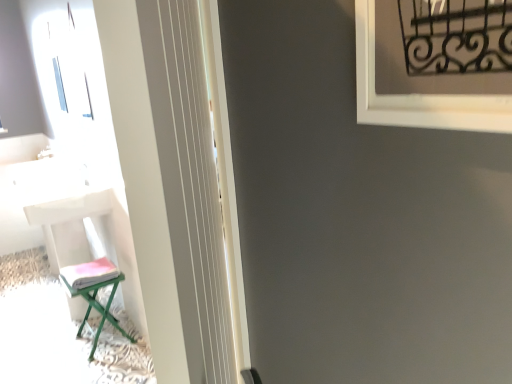
Describe the element at coordinates (87, 262) in the screenshot. I see `white plastic chair at left, the 1th furniture in the left-to-right sequence` at that location.

Identify the location of green metallic stool at lower left, the second furniture positioned from the left. (99, 308).

The image size is (512, 384). What do you see at coordinates (419, 95) in the screenshot?
I see `black wrought iron at upper right` at bounding box center [419, 95].

What do you see at coordinates (73, 221) in the screenshot? Image resolution: width=512 pixels, height=384 pixels. I see `white glossy table at left` at bounding box center [73, 221].

The height and width of the screenshot is (384, 512). I want to click on white plastic chair at left, marked as the second furniture in a right-to-left arrangement, so click(87, 262).

Based on the photo, would you say white glossy screen door at left is a long distance from black wrought iron at upper right?

No, white glossy screen door at left is not far from black wrought iron at upper right.

Find the location of a particular element. window frame above the white glossy screen door at left (from the image's perspective) is located at coordinates (419, 95).

Which object is further away from the camera taking this photo, white glossy screen door at left or black wrought iron at upper right?

Positioned behind is white glossy screen door at left.

Can you confirm if white glossy table at left is bigger than white glossy screen door at left?

Indeed, white glossy table at left has a larger size compared to white glossy screen door at left.

There is a white glossy table at left. Find the location of `screen door above it (from a real-world perspective)`. screen door above it (from a real-world perspective) is located at coordinates click(187, 206).

Does point (65, 213) lie behind point (205, 347)?

Yes.

From the image's perspective, between white glossy table at left and white glossy screen door at left, who is located below?

white glossy table at left is shown below in the image.

Would you say green metallic stool at lower left, the second furniture positioned from the left, is part of white glossy screen door at left's contents?

No.

From a real-world perspective, does white glossy screen door at left sit lower than green metallic stool at lower left, the 1th furniture positioned from the right?

No.

Locate an element on the screen. furniture that is the 2nd object directly below the white glossy screen door at left (from a real-world perspective) is located at coordinates (99, 308).

Choose the correct answer: Is white plastic chair at left, marked as the second furniture in a right-to-left arrangement, inside white glossy screen door at left or outside it?

white plastic chair at left, marked as the second furniture in a right-to-left arrangement, is outside white glossy screen door at left.

From the image's perspective, which one is positioned lower, white plastic chair at left, the 1th furniture in the left-to-right sequence, or white glossy screen door at left?

From the image's view, white plastic chair at left, the 1th furniture in the left-to-right sequence, is below.

Is white plastic chair at left, the 1th furniture in the left-to-right sequence, in contact with white glossy screen door at left?

white plastic chair at left, the 1th furniture in the left-to-right sequence, is not next to white glossy screen door at left, and they're not touching.

Is white plastic chair at left, the 1th furniture in the left-to-right sequence, looking in the opposite direction of white glossy screen door at left?

No, white plastic chair at left, the 1th furniture in the left-to-right sequence,'s orientation is not away from white glossy screen door at left.

Consider the image. From the image's perspective, between white plastic chair at left, the 1th furniture in the left-to-right sequence, and green metallic stool at lower left, the second furniture positioned from the left, which one is located above?

From the image's view, white plastic chair at left, the 1th furniture in the left-to-right sequence, is above.

Is white plastic chair at left, the 1th furniture in the left-to-right sequence, looking in the opposite direction of green metallic stool at lower left, the 1th furniture positioned from the right?

No, white plastic chair at left, the 1th furniture in the left-to-right sequence, is not facing the opposite direction of green metallic stool at lower left, the 1th furniture positioned from the right.

Does point (103, 275) come in front of point (100, 321)?

Yes.

Would you say white plastic chair at left, marked as the second furniture in a right-to-left arrangement, is a long distance from green metallic stool at lower left, the second furniture positioned from the left?

They are positioned close to each other.

Could you measure the distance between black wrought iron at upper right and green metallic stool at lower left, the 1th furniture positioned from the right?

black wrought iron at upper right is 6.77 feet from green metallic stool at lower left, the 1th furniture positioned from the right.

From their relative heights in the image, would you say black wrought iron at upper right is taller or shorter than green metallic stool at lower left, the second furniture positioned from the left?

black wrought iron at upper right is taller than green metallic stool at lower left, the second furniture positioned from the left.

Are black wrought iron at upper right and green metallic stool at lower left, the second furniture positioned from the left, making contact?

They are not placed beside each other.

In the image, is black wrought iron at upper right positioned in front of or behind green metallic stool at lower left, the second furniture positioned from the left?

black wrought iron at upper right is in front of green metallic stool at lower left, the second furniture positioned from the left.

Would you say white glossy table at left is to the left or to the right of green metallic stool at lower left, the 1th furniture positioned from the right, in the picture?

white glossy table at left is positioned on green metallic stool at lower left, the 1th furniture positioned from the right,'s left side.

Is green metallic stool at lower left, the second furniture positioned from the left, a part of white glossy table at left?

Definitely not — green metallic stool at lower left, the second furniture positioned from the left, is not inside white glossy table at left.

Could you tell me if white glossy table at left is facing green metallic stool at lower left, the 1th furniture positioned from the right?

No, white glossy table at left is not facing towards green metallic stool at lower left, the 1th furniture positioned from the right.

Is there a large distance between white glossy table at left and green metallic stool at lower left, the second furniture positioned from the left?

Actually, white glossy table at left and green metallic stool at lower left, the second furniture positioned from the left, are a little close together.

Where is `window frame above the white glossy screen door at left (from the image's perspective)`? This screenshot has height=384, width=512. window frame above the white glossy screen door at left (from the image's perspective) is located at coordinates (419, 95).

Where is `table located below the white glossy screen door at left (from the image's perspective)`? table located below the white glossy screen door at left (from the image's perspective) is located at coordinates (73, 221).

Estimate the real-world distances between objects in this image. Which object is closer to white plastic chair at left, the 1th furniture in the left-to-right sequence, white glossy screen door at left or white glossy table at left?

Based on the image, white glossy table at left appears to be nearer to white plastic chair at left, the 1th furniture in the left-to-right sequence.

Considering their positions, is white plastic chair at left, the 1th furniture in the left-to-right sequence, positioned closer to black wrought iron at upper right than green metallic stool at lower left, the second furniture positioned from the left?

Among the two, white plastic chair at left, the 1th furniture in the left-to-right sequence, is located nearer to black wrought iron at upper right.

When comparing their distances from black wrought iron at upper right, does green metallic stool at lower left, the second furniture positioned from the left, or white glossy table at left seem further?

Among the two, green metallic stool at lower left, the second furniture positioned from the left, is located further to black wrought iron at upper right.

Looking at the image, which one is located closer to green metallic stool at lower left, the 1th furniture positioned from the right, black wrought iron at upper right or white glossy screen door at left?

white glossy screen door at left is positioned closer to the anchor green metallic stool at lower left, the 1th furniture positioned from the right.

Estimate the real-world distances between objects in this image. Which object is closer to green metallic stool at lower left, the second furniture positioned from the left, white glossy table at left or white plastic chair at left, marked as the second furniture in a right-to-left arrangement?

The object closer to green metallic stool at lower left, the second furniture positioned from the left, is white plastic chair at left, marked as the second furniture in a right-to-left arrangement.

Looking at the image, which one is located further to green metallic stool at lower left, the second furniture positioned from the left, black wrought iron at upper right or white glossy table at left?

Based on the image, black wrought iron at upper right appears to be further to green metallic stool at lower left, the second furniture positioned from the left.

Which object lies nearer to the anchor point black wrought iron at upper right, white glossy table at left or green metallic stool at lower left, the second furniture positioned from the left?

Based on the image, white glossy table at left appears to be nearer to black wrought iron at upper right.

Estimate the real-world distances between objects in this image. Which object is further from white glossy table at left, black wrought iron at upper right or green metallic stool at lower left, the 1th furniture positioned from the right?

black wrought iron at upper right.

Identify the location of furniture between black wrought iron at upper right and white plastic chair at left, the 1th furniture in the left-to-right sequence, along the z-axis. (99, 308).

Locate an element on the screen. This screenshot has height=384, width=512. screen door located between black wrought iron at upper right and white glossy table at left in the depth direction is located at coordinates (187, 206).

Locate an element on the screen. screen door between black wrought iron at upper right and green metallic stool at lower left, the second furniture positioned from the left, from front to back is located at coordinates (187, 206).

The height and width of the screenshot is (384, 512). What are the coordinates of `screen door positioned between black wrought iron at upper right and white plastic chair at left, the 1th furniture in the left-to-right sequence, from near to far` in the screenshot? It's located at (187, 206).